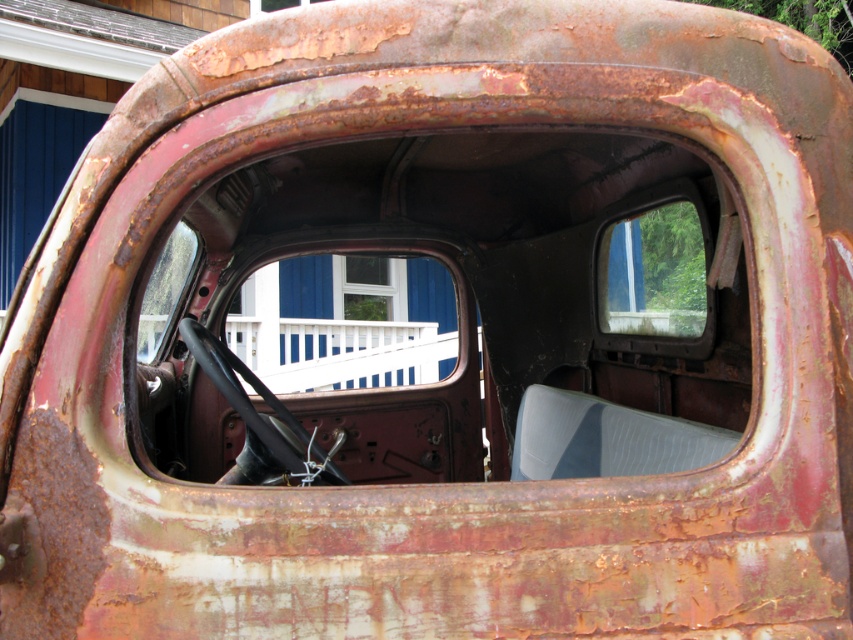
Question: Does white painted wood porch at center appear over transparent glass window at center?

Choices:
 (A) no
 (B) yes

Answer: (A)

Question: Which object appears farthest from the camera in this image?

Choices:
 (A) white painted wood porch at center
 (B) transparent glass window at center

Answer: (A)

Question: Can you confirm if white painted wood porch at center is positioned below transparent glass window at center?

Choices:
 (A) no
 (B) yes

Answer: (B)

Question: Among these objects, which one is farthest from the camera?

Choices:
 (A) transparent glass window at center
 (B) white painted wood porch at center

Answer: (B)

Question: Is white painted wood porch at center thinner than transparent glass window at center?

Choices:
 (A) yes
 (B) no

Answer: (B)